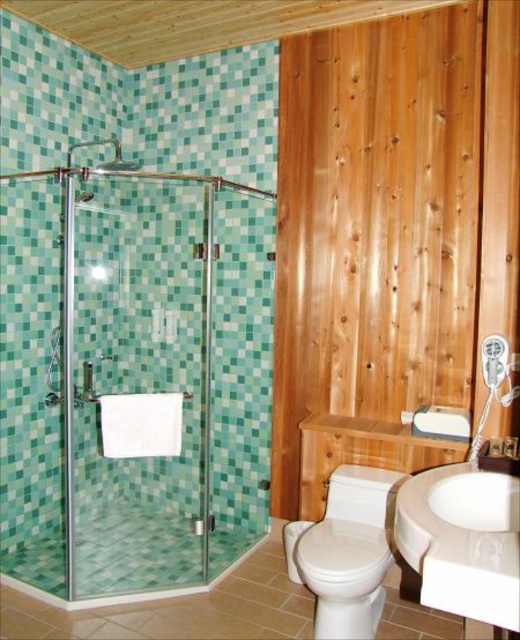
Question: In this image, where is white glossy sink at lower right located relative to white glossy toilet at lower center?

Choices:
 (A) below
 (B) above

Answer: (B)

Question: Which object is closer to the camera taking this photo?

Choices:
 (A) white glossy sink at lower right
 (B) clear glass shower door at left

Answer: (A)

Question: Which point is farther to the camera?

Choices:
 (A) (305, 570)
 (B) (66, 275)
 (C) (504, 614)

Answer: (B)

Question: Does white glossy sink at lower right appear under clear glass shower door at left?

Choices:
 (A) yes
 (B) no

Answer: (A)

Question: Among these objects, which one is farthest from the camera?

Choices:
 (A) clear glass shower door at left
 (B) white glossy toilet at lower center

Answer: (A)

Question: Does white glossy sink at lower right have a smaller size compared to white glossy toilet at lower center?

Choices:
 (A) yes
 (B) no

Answer: (A)